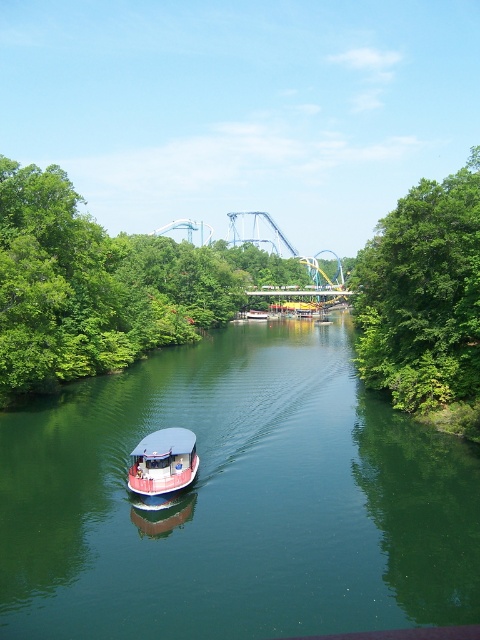
Is green smooth water at center closer to the viewer compared to white matte boat at center?

That is True.

Is point (324, 477) farther from camera compared to point (141, 451)?

Yes, it is behind point (141, 451).

Which is behind, point (191, 566) or point (137, 488)?

The point (137, 488) is more distant.

At what (x,y) coordinates should I click in order to perform the action: click on green smooth water at center. Please return your answer as a coordinate pair (x, y). This screenshot has height=640, width=480. Looking at the image, I should click on (237, 500).

Does green smooth water at center have a smaller size compared to metallic blue roller coaster at center?

Indeed, green smooth water at center has a smaller size compared to metallic blue roller coaster at center.

Who is positioned more to the left, green smooth water at center or metallic blue roller coaster at center?

green smooth water at center

Does point (369, 397) come farther from viewer compared to point (284, 250)?

No, (369, 397) is closer to viewer.

Image resolution: width=480 pixels, height=640 pixels. I want to click on green smooth water at center, so click(237, 500).

Between green leafy tree at right and metallic blue roller coaster at center, which one has less height?

With less height is metallic blue roller coaster at center.

Between green leafy tree at right and metallic blue roller coaster at center, which one appears on the left side from the viewer's perspective?

metallic blue roller coaster at center

Which is behind, point (453, 211) or point (265, 282)?

The point (265, 282) is more distant.

Locate an element on the screen. green leafy tree at right is located at coordinates (422, 294).